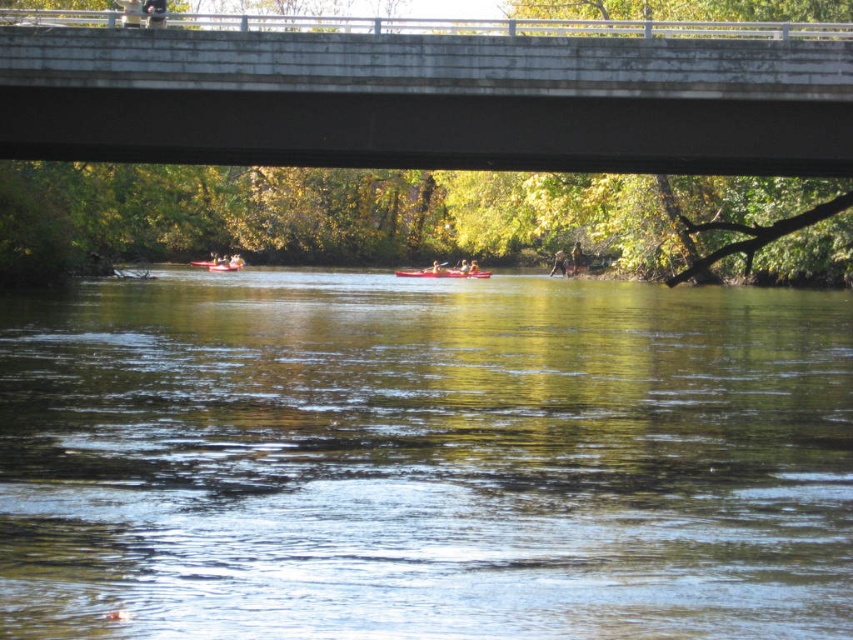
Between point (583, 550) and point (556, 272), which one is positioned in front?

Point (583, 550) is more forward.

Measure the distance between green reflective water at center and brown leather jacket at center.

green reflective water at center and brown leather jacket at center are 49.62 meters apart.

Who is more distant from viewer, (721,445) or (554,260)?

Positioned behind is point (554,260).

Image resolution: width=853 pixels, height=640 pixels. What are the coordinates of `green reflective water at center` in the screenshot? It's located at (424, 460).

Is matte red kayak at center shorter than brown leather jacket at center?

Yes, matte red kayak at center is shorter than brown leather jacket at center.

What do you see at coordinates (218, 264) in the screenshot? I see `matte red kayak at center` at bounding box center [218, 264].

Who is more forward, (225,268) or (563,259)?

Point (225,268) is more forward.

In order to click on matte red kayak at center in this screenshot , I will do `click(218, 264)`.

Does concrete bridge at upper center appear on the left side of brown leather jacket at center?

Indeed, concrete bridge at upper center is positioned on the left side of brown leather jacket at center.

Which is above, concrete bridge at upper center or brown leather jacket at center?

brown leather jacket at center is above.

Identify the location of concrete bridge at upper center. (431, 99).